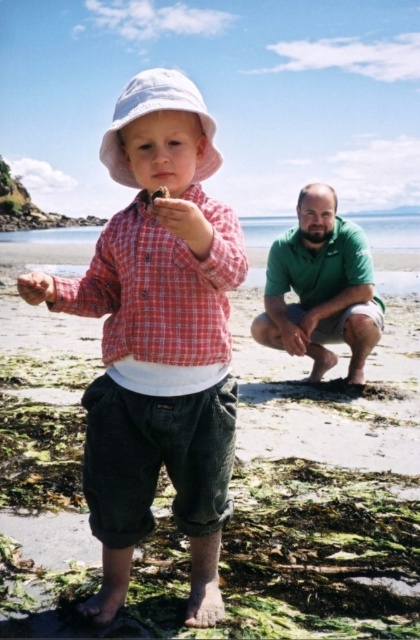
Question: Is red checkered shirt at center above white fabric hat at center?

Choices:
 (A) no
 (B) yes

Answer: (A)

Question: Based on their relative distances, which object is farther from the white fabric hat at center?

Choices:
 (A) red checkered shirt at center
 (B) green cotton shirt at lower right

Answer: (B)

Question: Is matte red plaid shirt at center above red checkered shirt at center?

Choices:
 (A) yes
 (B) no

Answer: (B)

Question: Which point is closer to the camera taking this photo?

Choices:
 (A) pyautogui.click(x=157, y=96)
 (B) pyautogui.click(x=348, y=328)
 (C) pyautogui.click(x=94, y=262)

Answer: (A)

Question: Among these points, which one is nearest to the camera?

Choices:
 (A) (120, 154)
 (B) (125, 284)
 (C) (280, 241)

Answer: (B)

Question: Is red checkered shirt at center closer to the viewer compared to white fabric hat at center?

Choices:
 (A) yes
 (B) no

Answer: (A)